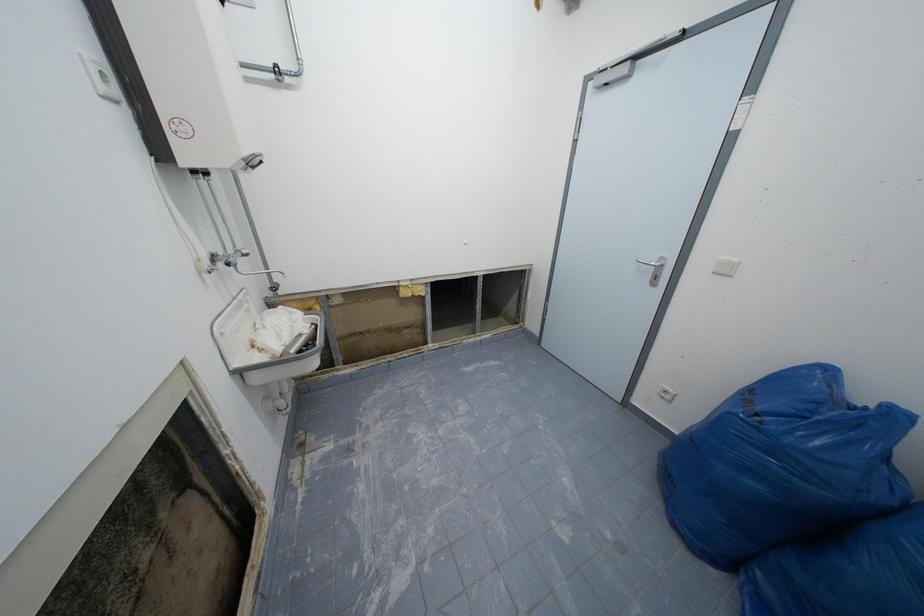
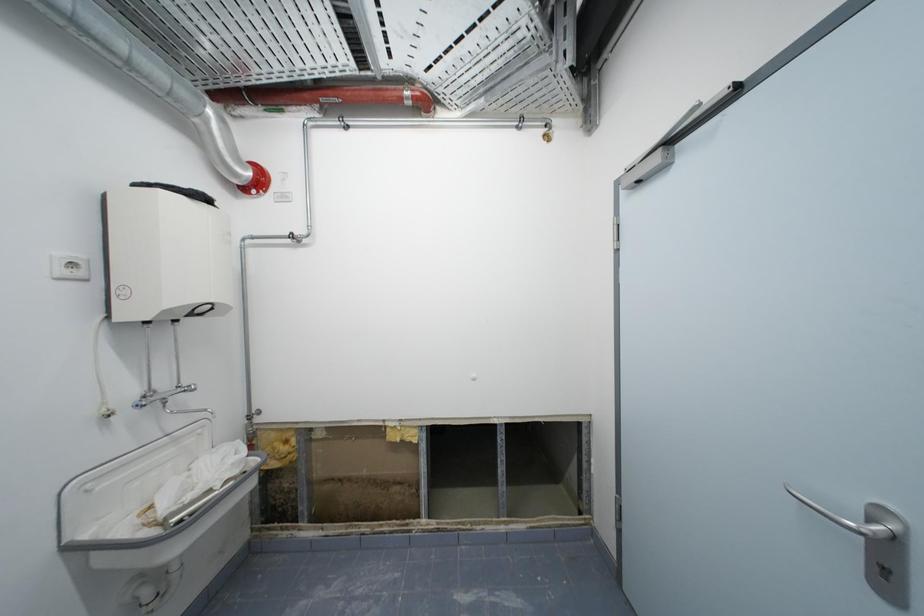
First-person continuous shooting, in which direction is the camera rotating?

The camera's rotation is toward left-up.